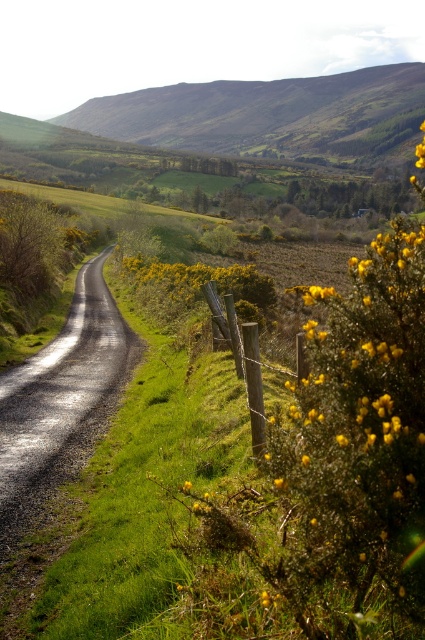
Consider the image. Can you confirm if green grassy hillside at upper center is smaller than wooden post at center?

No.

Which is in front, point (363, 161) or point (212, 288)?

Point (212, 288)

Does point (249, 90) come farther from viewer compared to point (220, 323)?

Yes.

The width and height of the screenshot is (425, 640). In order to click on green grassy hillside at upper center in this screenshot , I will do `click(268, 115)`.